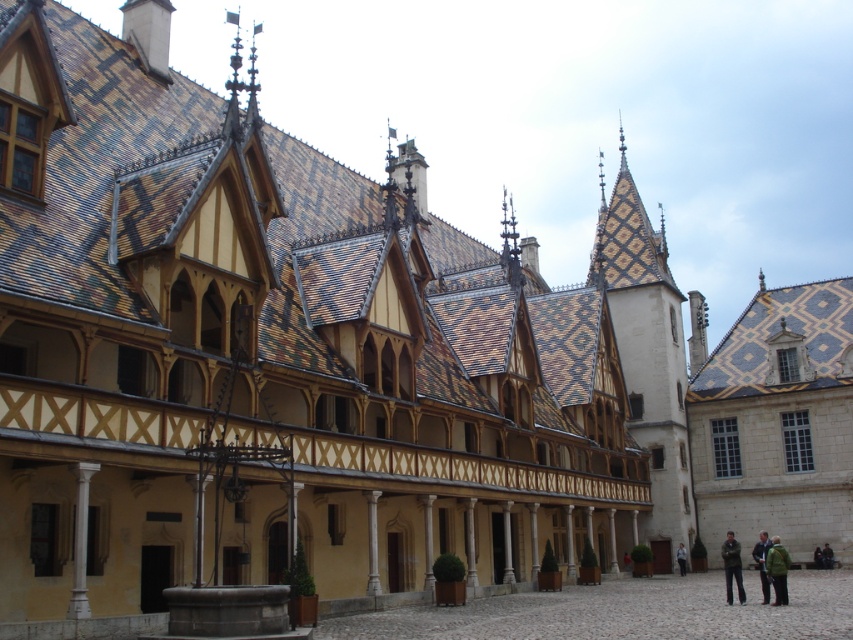
You are a tailor who needs to determine which jacket to place on a 1.2 meter wide tailor stand. Given that you have the light brown leather jacket at lower right and the green fabric jacket at lower right, which one can fit better on the stand?

The light brown leather jacket at lower right has a greater width than the green fabric jacket at lower right. Since the tailor stand is 1.2 meters wide, the green fabric jacket at lower right, being narrower, would fit better on the stand.

You are standing in front of the grand historic building and notice two jackets hanging on a rack at the lower right. Which jacket is closer to you, the dark blue jacket at lower right or the green fabric jacket at lower right?

The dark blue jacket at lower right is closer to you because it is in front of the green fabric jacket at lower right.

You are an assistant organizing a historical clothing exhibit. You see the light brown leather jacket at lower right and the green fabric jacket at lower right. Which jacket is placed on top of the other?

The light brown leather jacket at lower right is positioned over the green fabric jacket at lower right.